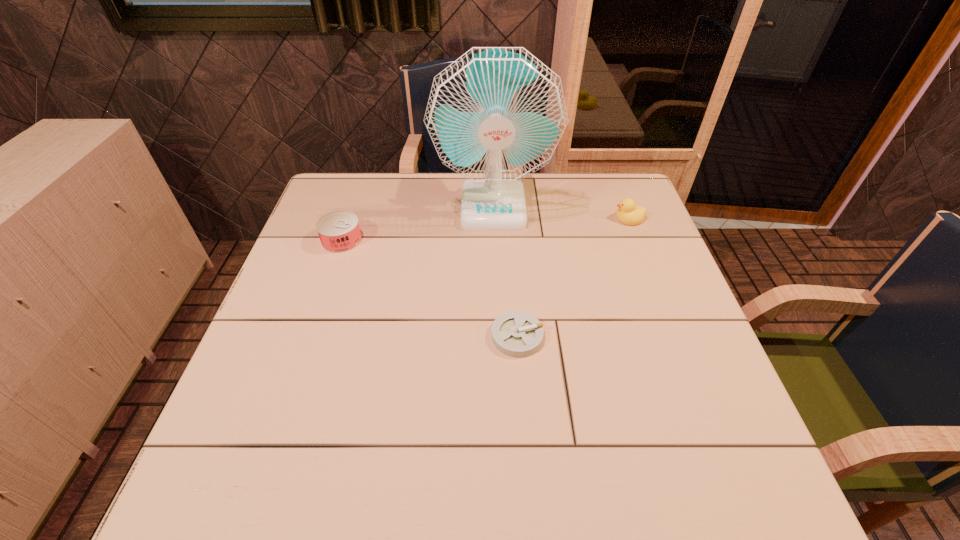
You are a GUI agent. You are given a task and a screenshot of the screen. Output one action in this format:
    pyautogui.click(x=<x>, y=<y>)
    Task: Click on the vacant space at the far left corner
    
    Given the screenshot: What is the action you would take?
    pyautogui.click(x=337, y=175)

Identify the location of vacant point located between the fan and the rightmost object. (561, 212).

Image resolution: width=960 pixels, height=540 pixels. Find the location of `vacant area that lies between the fan and the rightmost object`. vacant area that lies between the fan and the rightmost object is located at coordinates (561, 212).

Where is `vacant region between the can and the fan`? The image size is (960, 540). vacant region between the can and the fan is located at coordinates (418, 223).

This screenshot has width=960, height=540. In order to click on free space between the can and the tallest object in this screenshot , I will do `click(418, 223)`.

Find the location of a particular element. empty location between the ashtray and the fan is located at coordinates (505, 272).

Find the location of a particular element. free point between the ashtray and the fan is located at coordinates (505, 272).

The width and height of the screenshot is (960, 540). What are the coordinates of `object that stands as the second closest to the leftmost object` in the screenshot? It's located at (515, 333).

Locate which object ranks third in proximity to the fan. Please provide its 2D coordinates. Your answer should be formatted as a tuple, i.e. [(x, y)], where the tuple contains the x and y coordinates of a point satisfying the conditions above.

[(515, 333)]

Where is `vacant area that satisfies the following two spatial constraints: 1. in front of the tallest object to face the airflow; 2. on the right side of the ashtray`? vacant area that satisfies the following two spatial constraints: 1. in front of the tallest object to face the airflow; 2. on the right side of the ashtray is located at coordinates (498, 336).